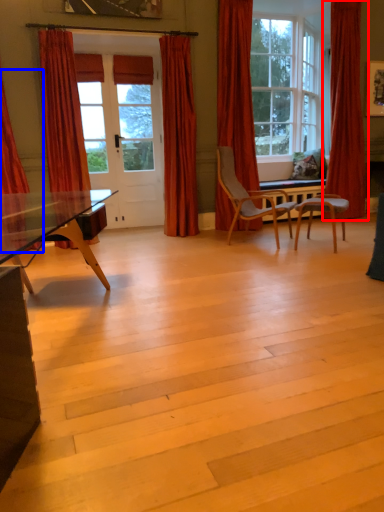
Question: Which object appears farthest to the camera in this image, curtain (highlighted by a red box) or curtain (highlighted by a blue box)?

Choices:
 (A) curtain
 (B) curtain

Answer: (A)